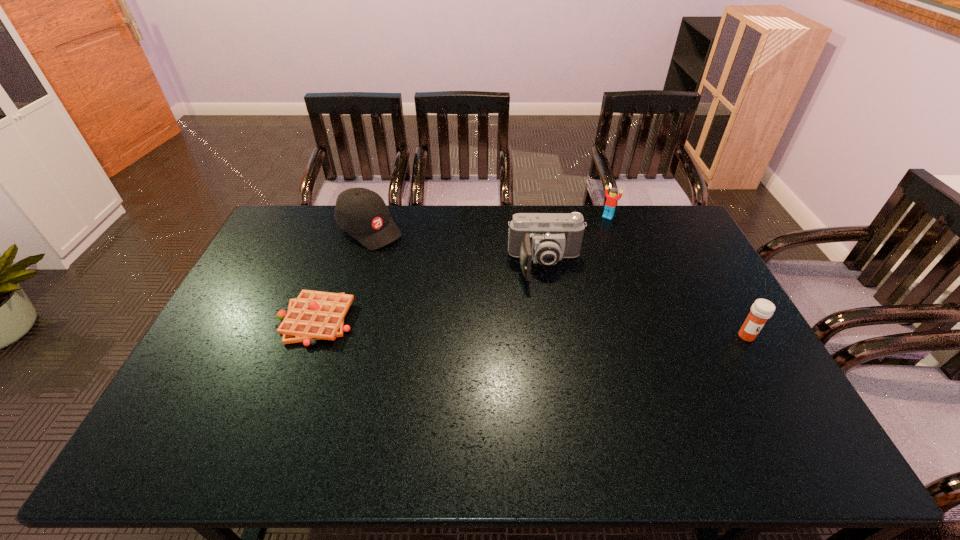
Image resolution: width=960 pixels, height=540 pixels. I want to click on free space between the baseball cap and the camera, so click(x=458, y=247).

The width and height of the screenshot is (960, 540). In order to click on vacant space in between the third object from left to right and the waffle in this screenshot , I will do click(431, 293).

Identify which object is the third nearest to the camera. Please provide its 2D coordinates. Your answer should be formatted as a tuple, i.e. [(x, y)], where the tuple contains the x and y coordinates of a point satisfying the conditions above.

[(761, 310)]

This screenshot has height=540, width=960. What are the coordinates of `object that is the fourth closest to the third object from right to left` in the screenshot? It's located at (313, 315).

Identify the location of vacant space that satisfies the following two spatial constraints: 1. on the back side of the shortest object; 2. on the left side of the camera. (336, 266).

Identify the location of blank area in the image that satisfies the following two spatial constraints: 1. on the back side of the camera; 2. on the right side of the Lego. (538, 217).

Locate an element on the screen. vacant space that satisfies the following two spatial constraints: 1. on the back side of the Lego; 2. on the left side of the third object from right to left is located at coordinates (538, 217).

The height and width of the screenshot is (540, 960). I want to click on vacant space that satisfies the following two spatial constraints: 1. on the back side of the shortest object; 2. on the right side of the Lego, so click(353, 217).